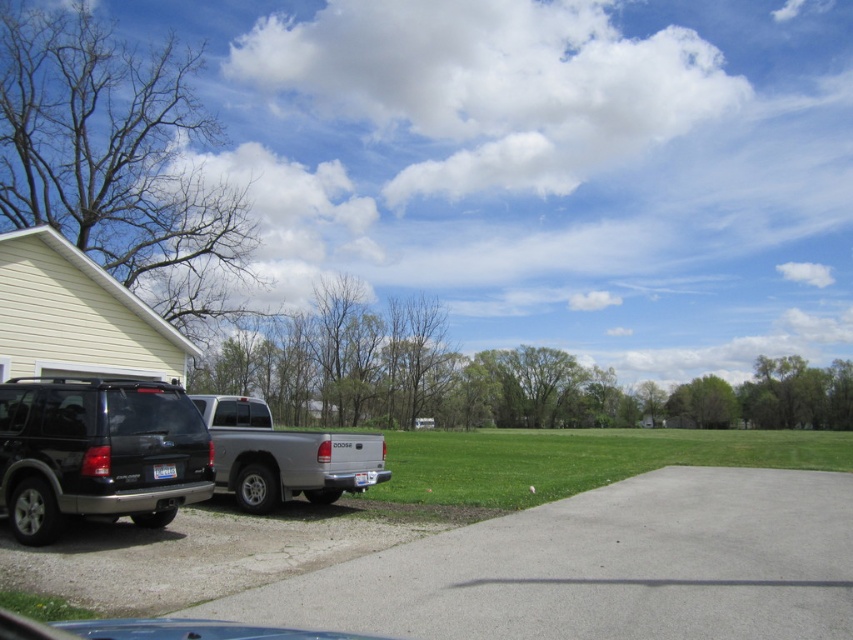
Question: Based on their relative distances, which object is nearer to the shiny black suv at lower left?

Choices:
 (A) silver metallic truck at center
 (B) gray concrete driveway at lower left

Answer: (A)

Question: Which is farther from the silver metallic truck at center?

Choices:
 (A) gray concrete driveway at lower left
 (B) shiny black suv at lower left

Answer: (A)

Question: Which of the following is the farthest from the observer?

Choices:
 (A) gray concrete driveway at lower left
 (B) shiny black suv at lower left

Answer: (B)

Question: Does gray concrete driveway at lower left appear on the left side of shiny black suv at lower left?

Choices:
 (A) yes
 (B) no

Answer: (B)

Question: From the image, what is the correct spatial relationship of gray concrete driveway at lower left in relation to shiny black suv at lower left?

Choices:
 (A) left
 (B) right

Answer: (B)

Question: Does shiny black suv at lower left lie in front of silver metallic truck at center?

Choices:
 (A) yes
 (B) no

Answer: (A)